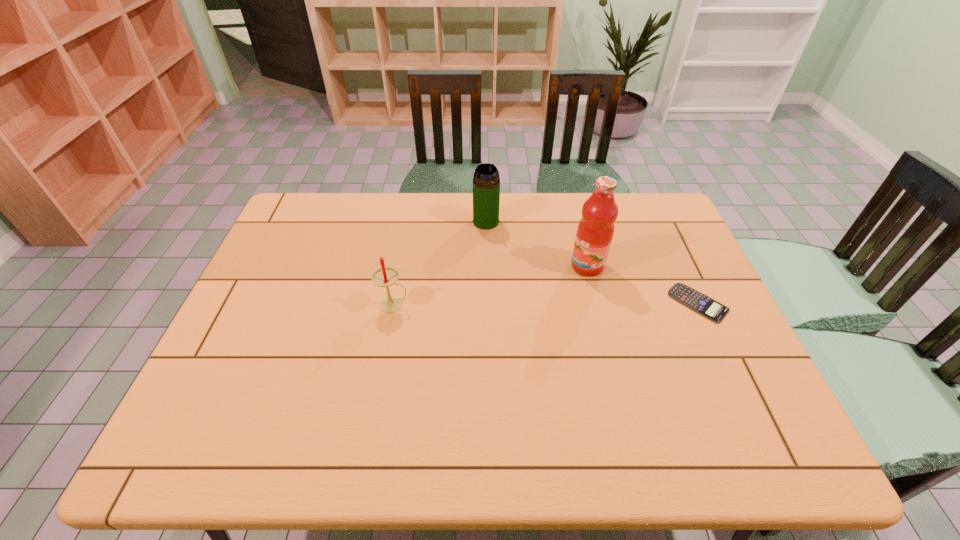
Locate an element on the screen. This screenshot has width=960, height=540. empty location between the rightmost object and the tallest object is located at coordinates (643, 285).

Locate an element on the screen. object that ranks as the second closest to the fruit juice is located at coordinates (486, 183).

The image size is (960, 540). I want to click on object that can be found as the second closest to the shortest object, so coord(486,183).

Locate an element on the screen. This screenshot has width=960, height=540. free space that satisfies the following two spatial constraints: 1. on the front side of the thermos bottle; 2. on the left side of the second farthest object is located at coordinates (487, 266).

The image size is (960, 540). I want to click on vacant space that satisfies the following two spatial constraints: 1. on the back side of the third nearest object; 2. on the right side of the candle, so click(401, 266).

Locate an element on the screen. free space that satisfies the following two spatial constraints: 1. on the front side of the rightmost object; 2. on the right side of the farthest object is located at coordinates (488, 303).

The width and height of the screenshot is (960, 540). What are the coordinates of `vacant space that satisfies the following two spatial constraints: 1. on the back side of the calculator; 2. on the right side of the candle` in the screenshot? It's located at (395, 303).

Where is `free space that satisfies the following two spatial constraints: 1. on the back side of the third tallest object; 2. on the left side of the rightmost object`? free space that satisfies the following two spatial constraints: 1. on the back side of the third tallest object; 2. on the left side of the rightmost object is located at coordinates (395, 303).